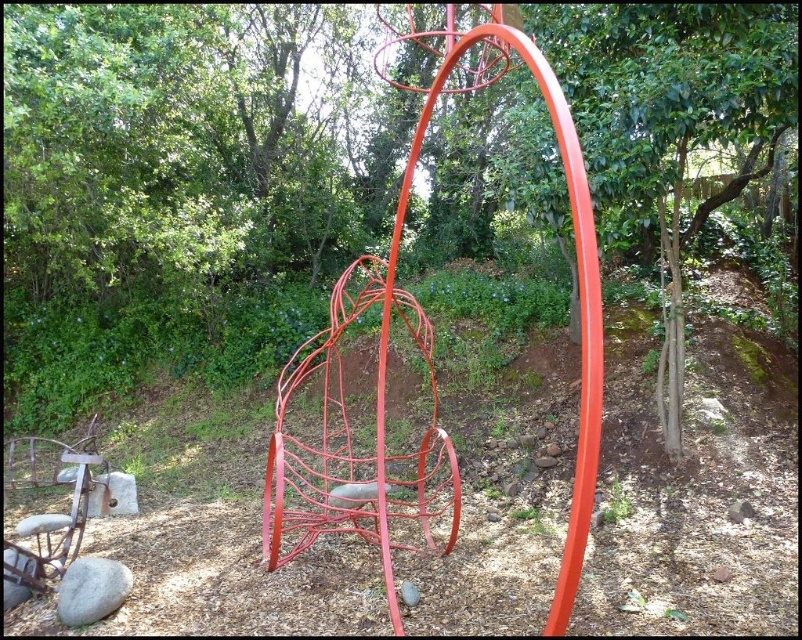
Does point (391, 486) come closer to viewer compared to point (102, 598)?

No, (391, 486) is behind (102, 598).

Who is higher up, glossy metal basketball hoop at center or gray smooth rock at lower left?

Positioned higher is glossy metal basketball hoop at center.

You are a GUI agent. You are given a task and a screenshot of the screen. Output one action in this format:
    pyautogui.click(x=<x>, y=<y>)
    Task: Click on the glossy metal basketball hoop at center
    The height and width of the screenshot is (640, 802).
    Given the screenshot: What is the action you would take?
    pyautogui.click(x=428, y=356)